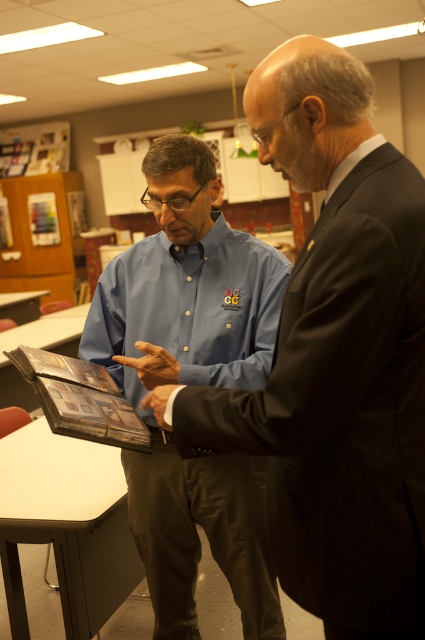
Question: Which point is farther to the camera?

Choices:
 (A) white glossy table at lower left
 (B) blue shirt at center

Answer: (A)

Question: Can you confirm if blue shirt at center is smaller than white glossy table at lower left?

Choices:
 (A) no
 (B) yes

Answer: (B)

Question: Is blue cotton shirt at center wider than white glossy table at lower left?

Choices:
 (A) no
 (B) yes

Answer: (A)

Question: Among these objects, which one is nearest to the camera?

Choices:
 (A) blue cotton shirt at center
 (B) blue shirt at center

Answer: (B)

Question: Does blue shirt at center appear on the right side of blue cotton shirt at center?

Choices:
 (A) no
 (B) yes

Answer: (B)

Question: Which point appears closest to the camera in this image?

Choices:
 (A) pyautogui.click(x=104, y=556)
 (B) pyautogui.click(x=255, y=122)

Answer: (B)